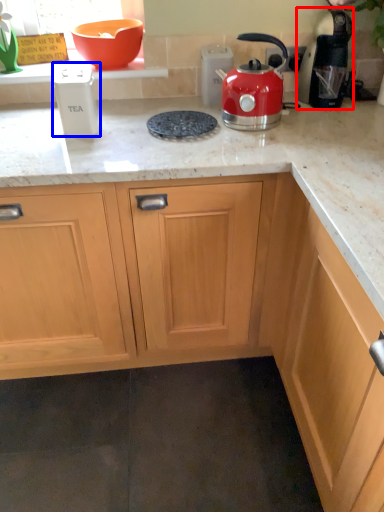
Question: Which object appears farthest to the camera in this image, kitchen appliance (highlighted by a red box) or kitchen appliance (highlighted by a blue box)?

Choices:
 (A) kitchen appliance
 (B) kitchen appliance

Answer: (A)